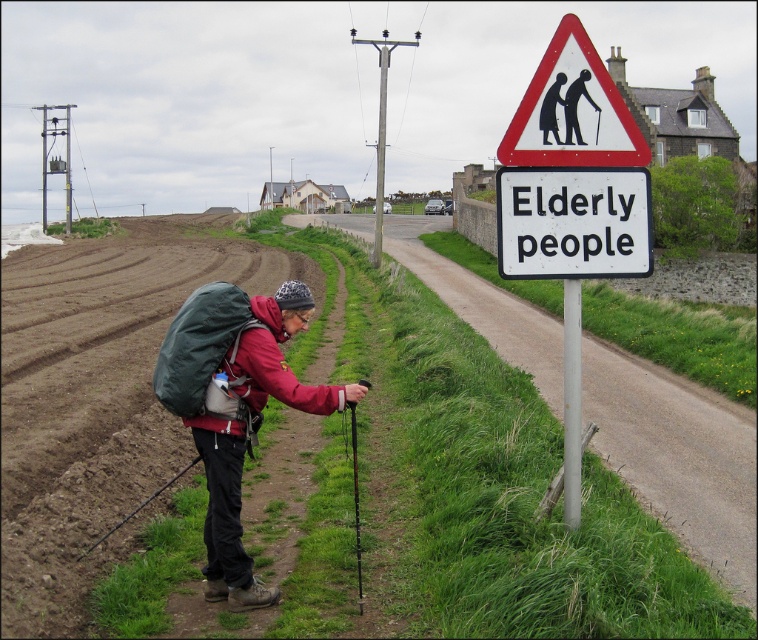
You are a hiker who wants to place a black plastic cane at upper center onto the white plastic elderly people sign at upper right. Is this possible based on their positions?

The white plastic elderly people sign at upper right is below the black plastic cane at upper center, so placing the black plastic cane at upper center onto the white plastic elderly people sign at upper right would not be possible due to their vertical positions.

You are a hiker who just passed the metallic pole at right and want to check the white plastic elderly people sign at upper right. Which direction should you move to face the sign?

The white plastic elderly people sign at upper right is to the right of the metallic pole at right. Since you are facing the direction you were walking after passing the metallic pole at right, you should turn to your right to face the white plastic elderly people sign at upper right.

You are a hiker who needs to place a 24 inch long hiking pole between the metallic pole at right and the black fabric backpack at lower left. Is there enough space between them to fit the pole horizontally?

The metallic pole at right and the black fabric backpack at lower left are 31.35 inches apart. Since the pole is 24 inches long, there is enough space to fit it horizontally between them.